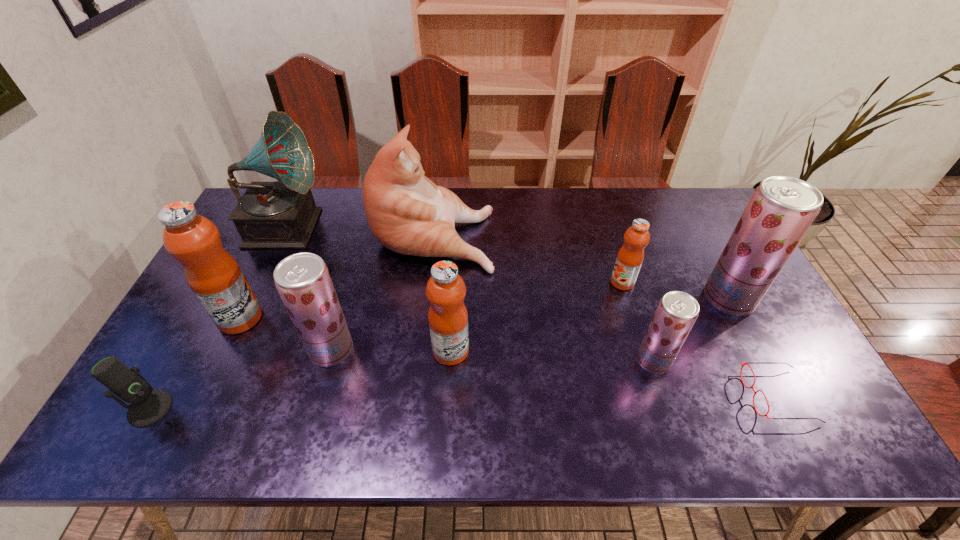
Locate an element on the screen. The image size is (960, 540). orange fruit juice that can be found as the second closest to the record player is located at coordinates (448, 318).

Locate an element on the screen. The image size is (960, 540). free space that satisfies the following two spatial constraints: 1. on the front side of the rightmost strawberry fruit juice; 2. on the front label of the second smallest orange fruit juice is located at coordinates (x=756, y=351).

At what (x,y) coordinates should I click in order to perform the action: click on free space that satisfies the following two spatial constraints: 1. on the front label of the second orange fruit juice from left to right; 2. on the front side of the second shortest object. Please return your answer as a coordinate pair (x, y). Looking at the image, I should click on (447, 408).

This screenshot has width=960, height=540. Find the location of `vacant area that satisfies the following two spatial constraints: 1. on the back side of the second shortest object; 2. on the left side of the smallest strawberry fruit juice`. vacant area that satisfies the following two spatial constraints: 1. on the back side of the second shortest object; 2. on the left side of the smallest strawberry fruit juice is located at coordinates (177, 361).

Identify the location of free space that satisfies the following two spatial constraints: 1. on the face of the cat; 2. on the back side of the rightmost fruit juice. (426, 299).

Locate an element on the screen. Image resolution: width=960 pixels, height=540 pixels. free spot that satisfies the following two spatial constraints: 1. on the front label of the leftmost orange fruit juice; 2. on the back side of the smallest strawberry fruit juice is located at coordinates (220, 361).

Locate an element on the screen. This screenshot has width=960, height=540. free space that satisfies the following two spatial constraints: 1. on the front label of the second nearest orange fruit juice; 2. on the back side of the second strawberry fruit juice from right to left is located at coordinates (220, 361).

Locate an element on the screen. This screenshot has width=960, height=540. free spot that satisfies the following two spatial constraints: 1. on the back side of the farthest strawberry fruit juice; 2. on the right side of the second biggest strawberry fruit juice is located at coordinates (346, 299).